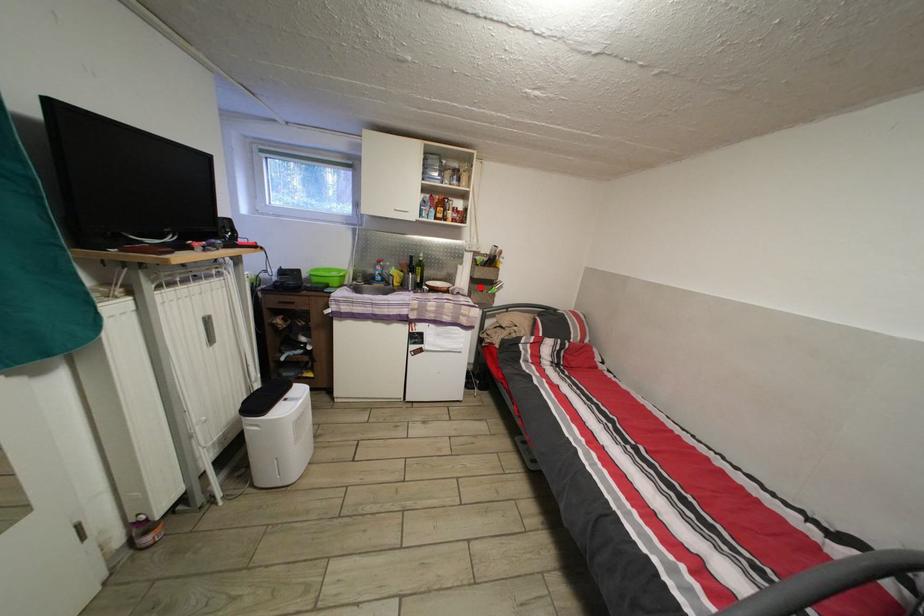
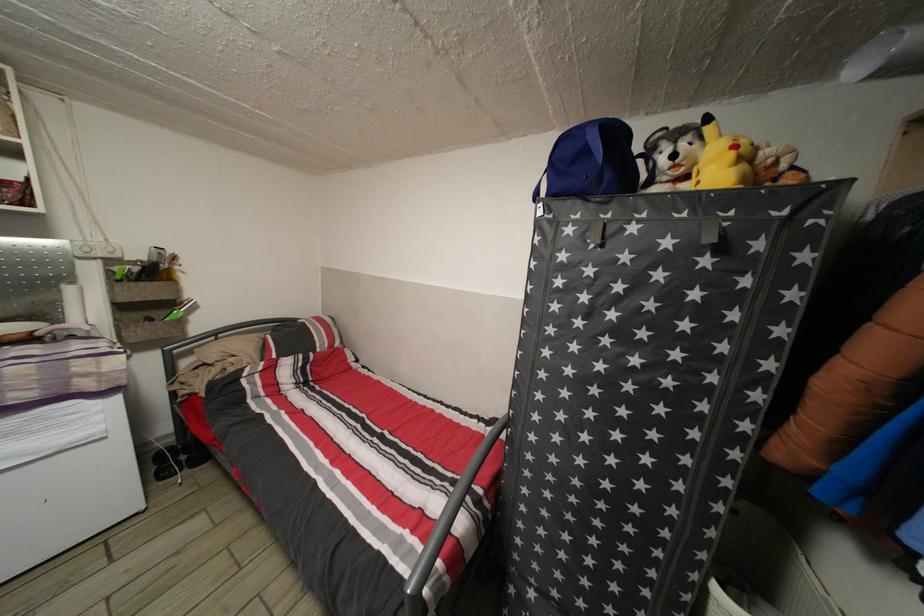
Find the pixel in the second image that matches the highlighted location in the first image.

(128, 314)